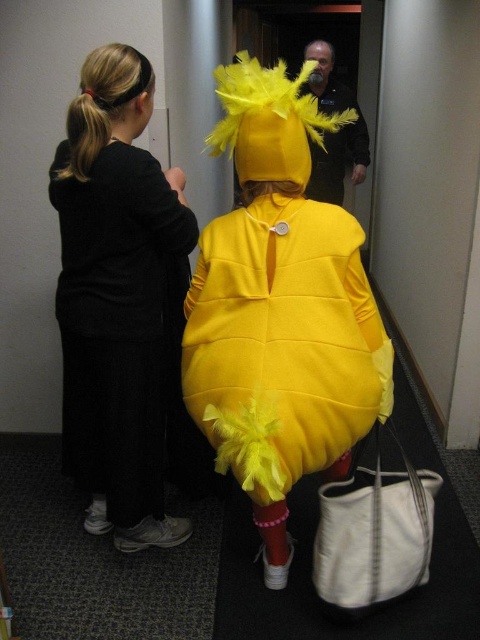
You are standing in the hallway and want to take a photo of the matte yellow costume at center without the black fabric dress at left appearing in the frame. Is this possible given their positions?

The black fabric dress at left is positioned over the matte yellow costume at center, so it would block the view. You cannot take a photo of the matte yellow costume at center without the black fabric dress at left appearing in the frame.

You are standing in the hallway and need to pass by the matte yellow costume at center. There is a black fabric dress at left nearby. How far apart are these two items?

The black fabric dress at left is 18.07 inches from matte yellow costume at center.